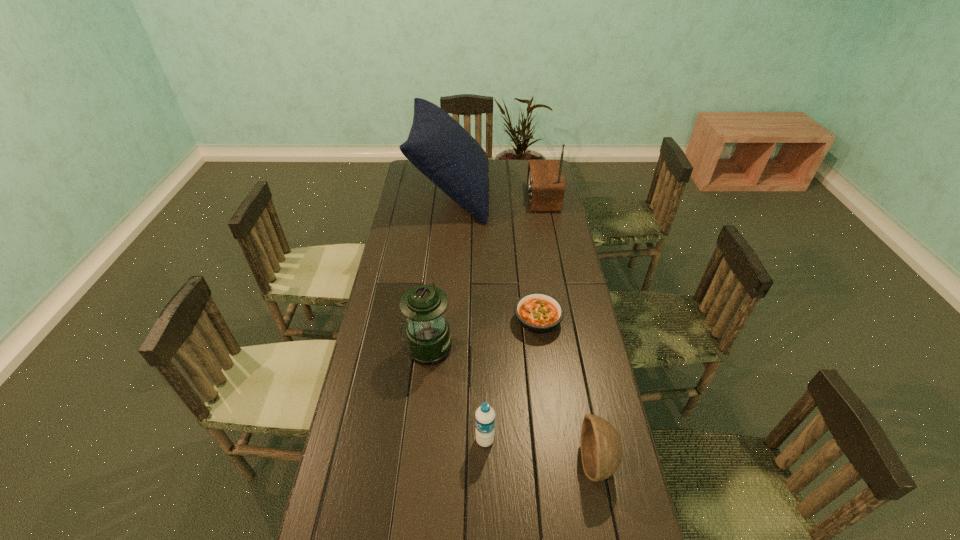
You are a GUI agent. You are given a task and a screenshot of the screen. Output one action in this format:
    pyautogui.click(x=<x>, y=<y>)
    Task: Click on the free space located 0.050m on the right of the third tallest object
    
    Given the screenshot: What is the action you would take?
    pyautogui.click(x=467, y=347)

Find the location of a particular element. Image resolution: width=960 pixels, height=540 pixels. vacant position located on the label of the water bottle is located at coordinates (357, 440).

The image size is (960, 540). In order to click on free space located 0.050m on the label of the water bottle in this screenshot , I will do (x=458, y=440).

Locate an element on the screen. Image resolution: width=960 pixels, height=540 pixels. vacant region located on the label of the water bottle is located at coordinates (353, 440).

You are a GUI agent. You are given a task and a screenshot of the screen. Output one action in this format:
    pyautogui.click(x=<x>, y=<y>)
    Task: Click on the vacant space located 0.320m on the back of the bowl
    
    Given the screenshot: What is the action you would take?
    pyautogui.click(x=574, y=344)

The image size is (960, 540). What are the coordinates of `free space located on the front of the stew` in the screenshot? It's located at (543, 365).

The height and width of the screenshot is (540, 960). Find the location of `object present at the far edge`. object present at the far edge is located at coordinates (438, 146).

Find the location of a particular element. The height and width of the screenshot is (540, 960). cushion at the left edge is located at coordinates (438, 146).

Identify the location of lantern positioned at the left edge. This screenshot has height=540, width=960. (428, 342).

The image size is (960, 540). Find the location of `radio receiver that is positioned at the right edge`. radio receiver that is positioned at the right edge is located at coordinates tap(545, 183).